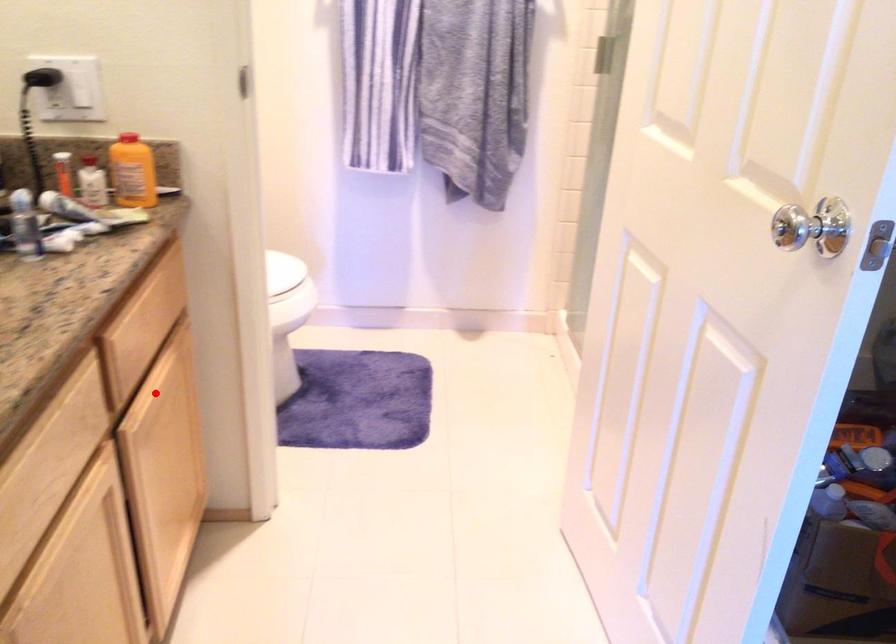
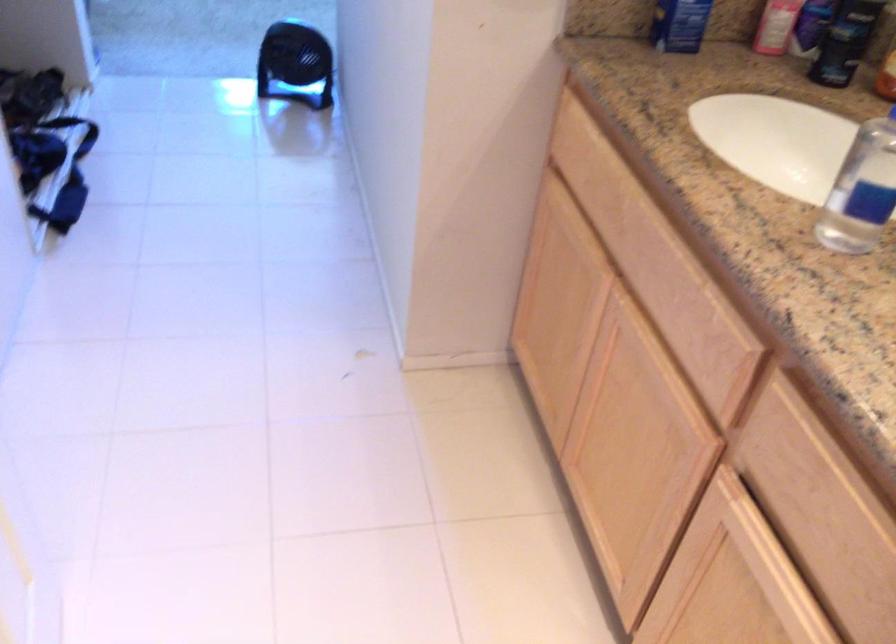
Question: I am providing you with two images of the same scene from different viewpoints. A red point is shown in image1. For the corresponding object point in image2, is it positioned nearer or farther from the camera?

Choices:
 (A) Nearer
 (B) Farther

Answer: (A)